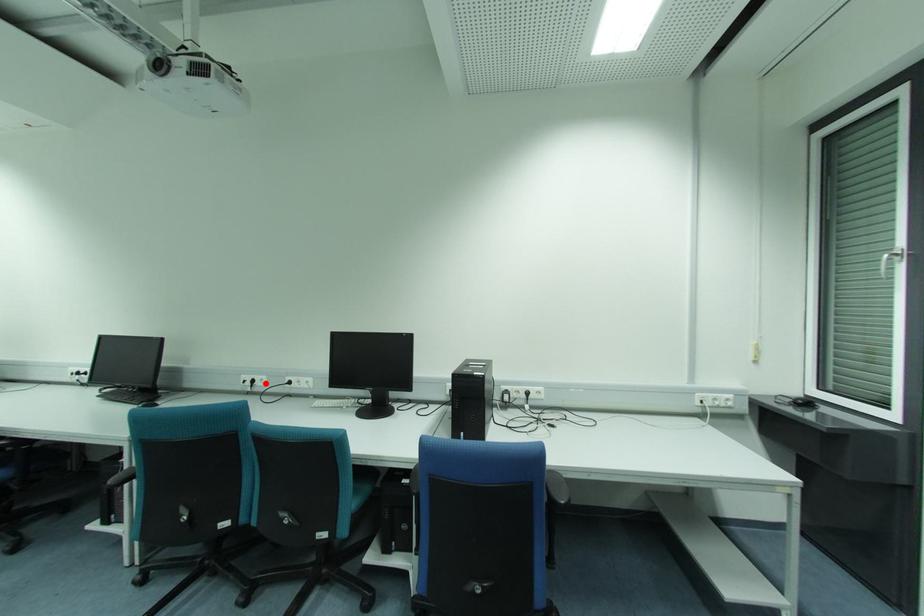
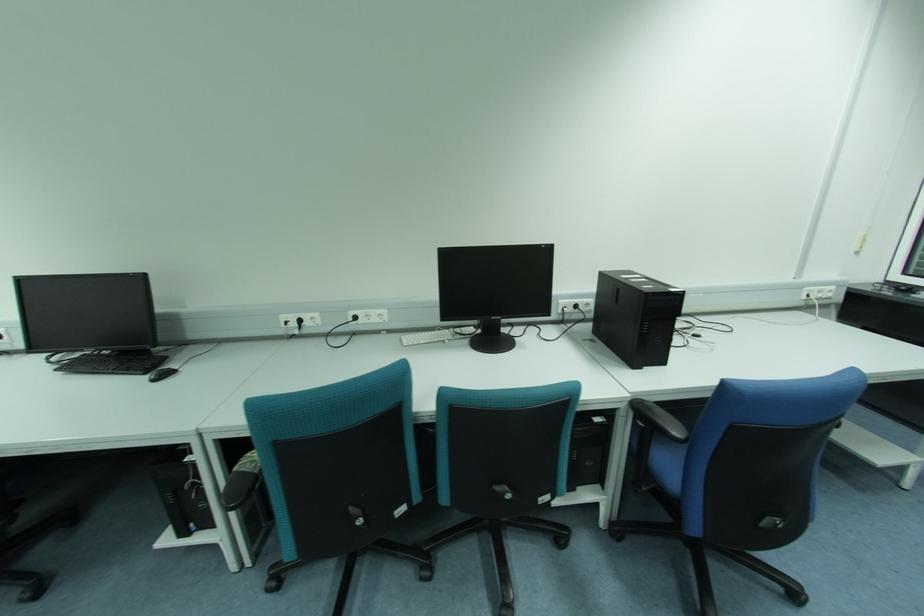
The point at the highlighted location is marked in the first image. Where is the corresponding point in the second image?

(319, 322)